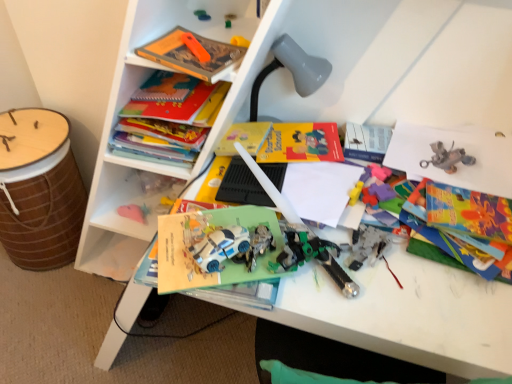
The height and width of the screenshot is (384, 512). In order to click on vacant point to the left of white plastic toy car at center in this screenshot , I will do `click(177, 251)`.